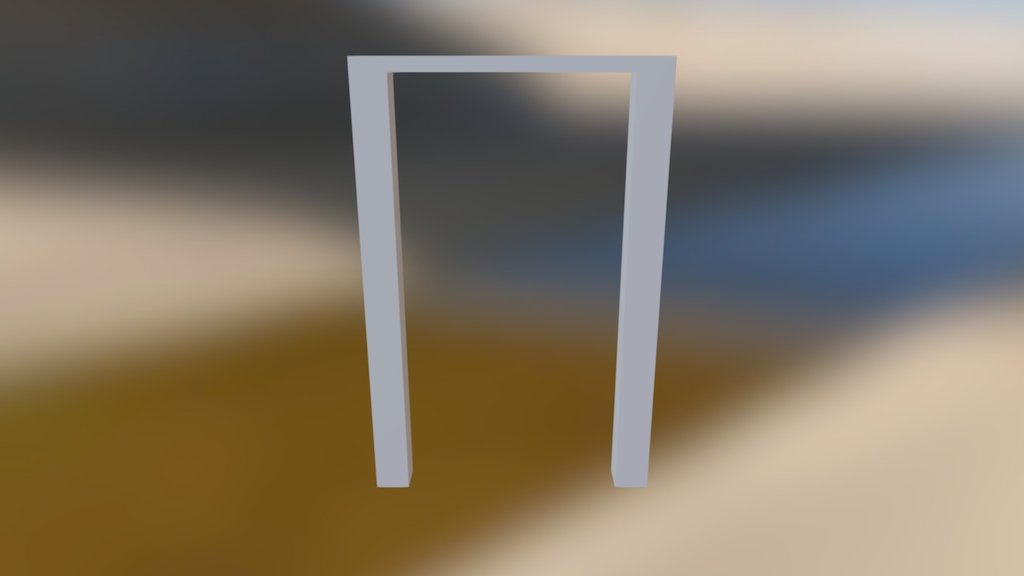
Identify the location of table base (very rudimentary). (467, 59).